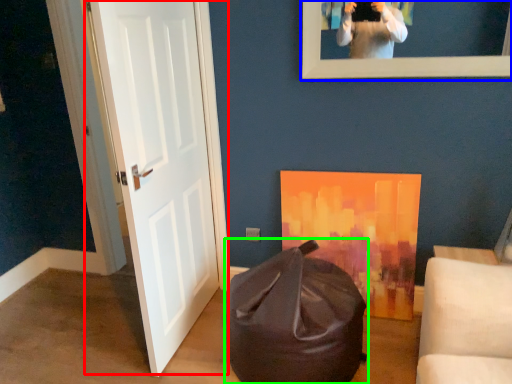
Question: Which is nearer to the door (highlighted by a red box)? picture frame (highlighted by a blue box) or bean bag chair (highlighted by a green box).

Choices:
 (A) picture frame
 (B) bean bag chair

Answer: (B)